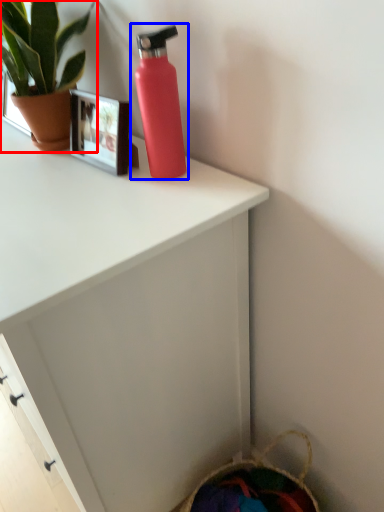
Question: Among these objects, which one is nearest to the camera, houseplant (highlighted by a red box) or bottle (highlighted by a blue box)?

Choices:
 (A) houseplant
 (B) bottle

Answer: (B)